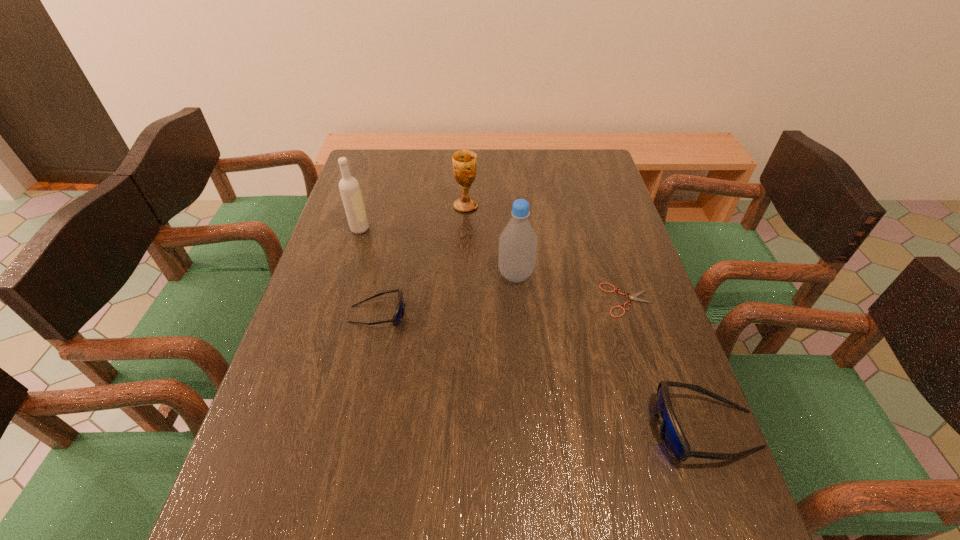
Identify the location of the fifth tallest object. (399, 312).

At what (x,y) coordinates should I click in order to perform the action: click on the left sunglasses. Please return your answer as a coordinate pair (x, y). Looking at the image, I should click on (399, 312).

I want to click on the nearest object, so click(672, 436).

Identify the location of the right sunglasses. (672, 436).

This screenshot has width=960, height=540. I want to click on chalice, so click(x=464, y=162).

Find the location of `the third object from left to right`. the third object from left to right is located at coordinates (464, 162).

Locate an element on the screen. This screenshot has height=540, width=960. the shortest object is located at coordinates coord(632,297).

Where is `the leftmost object`? This screenshot has width=960, height=540. the leftmost object is located at coordinates (349, 187).

At what (x,y) coordinates should I click in order to perform the action: click on the second farthest object. Please return your answer as a coordinate pair (x, y). The height and width of the screenshot is (540, 960). Looking at the image, I should click on (349, 187).

Identify the location of the third object from right to left. click(x=518, y=242).